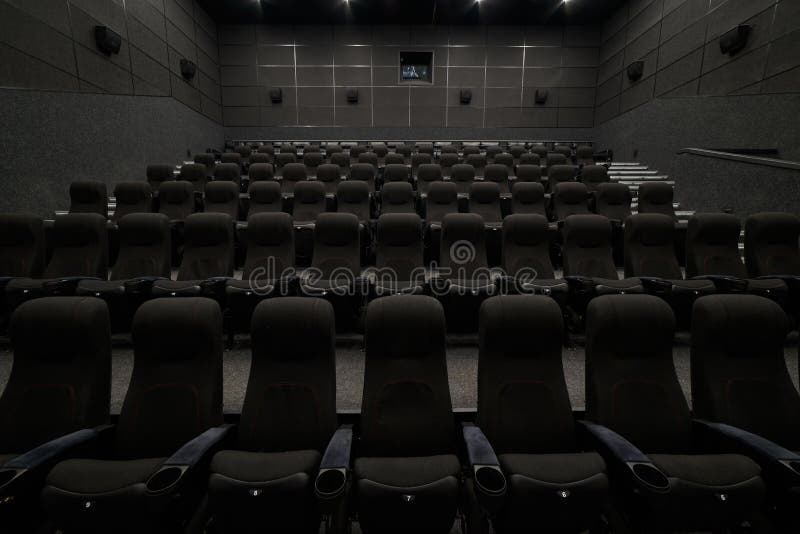
This screenshot has width=800, height=534. Identify the location of row of seats. (414, 369), (409, 243), (404, 207), (406, 176), (396, 160), (397, 144).